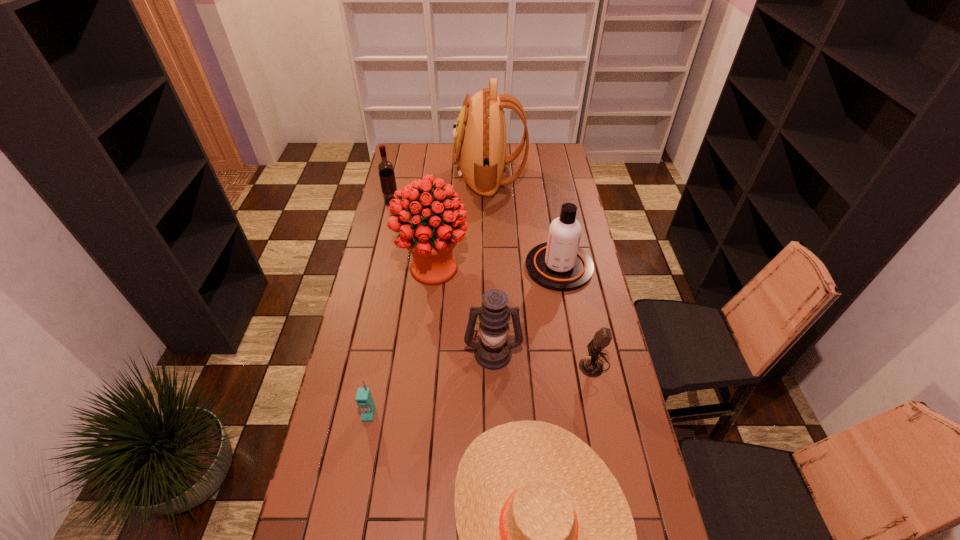
The height and width of the screenshot is (540, 960). I want to click on wine bottle that is at the left edge, so click(x=385, y=168).

The width and height of the screenshot is (960, 540). What are the coordinates of `cellular telephone situated at the left edge` in the screenshot? It's located at (364, 399).

This screenshot has width=960, height=540. Identify the location of cleansing agent situated at the right edge. (559, 264).

The image size is (960, 540). Find the location of `microphone at the right edge`. microphone at the right edge is located at coordinates (591, 366).

Identify the location of vacant space at the far edge of the desktop. (519, 167).

You are a GUI agent. You are given a task and a screenshot of the screen. Output one action in this format:
    pyautogui.click(x=<x>, y=<y>)
    Task: Click on the vacant space at the left edge
    The image size is (960, 540).
    Given the screenshot: What is the action you would take?
    pyautogui.click(x=362, y=319)

Locate an element on the screen. free spot between the second nearest object and the backpack is located at coordinates (429, 295).

Locate an element on the screen. Image resolution: width=960 pixels, height=540 pixels. empty space between the oil lamp and the seventh farthest object is located at coordinates (431, 383).

Where is `empty space between the cellular telephone and the bouquet`? empty space between the cellular telephone and the bouquet is located at coordinates (401, 341).

Where is `vacant region between the cleansing agent and the backpack`? This screenshot has height=540, width=960. vacant region between the cleansing agent and the backpack is located at coordinates (524, 221).